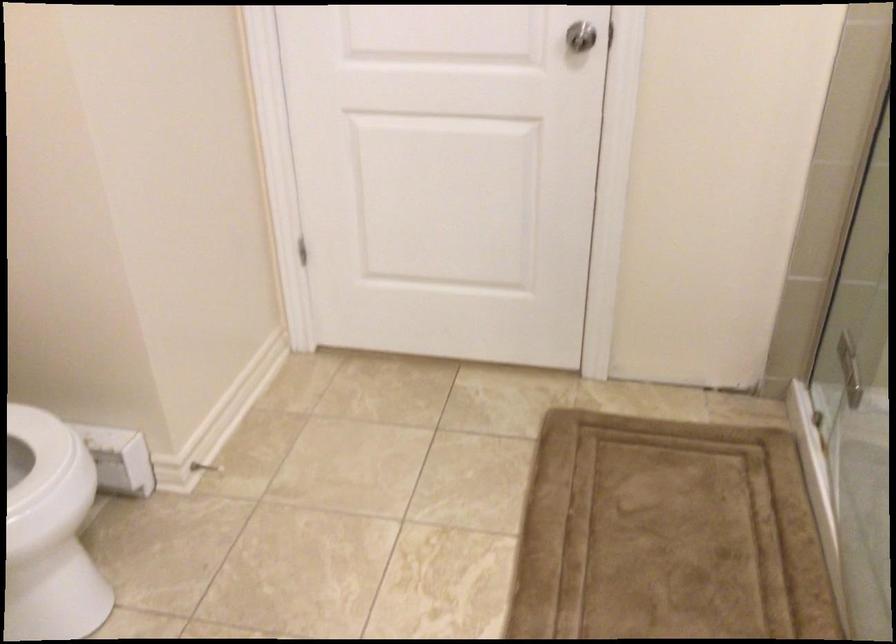
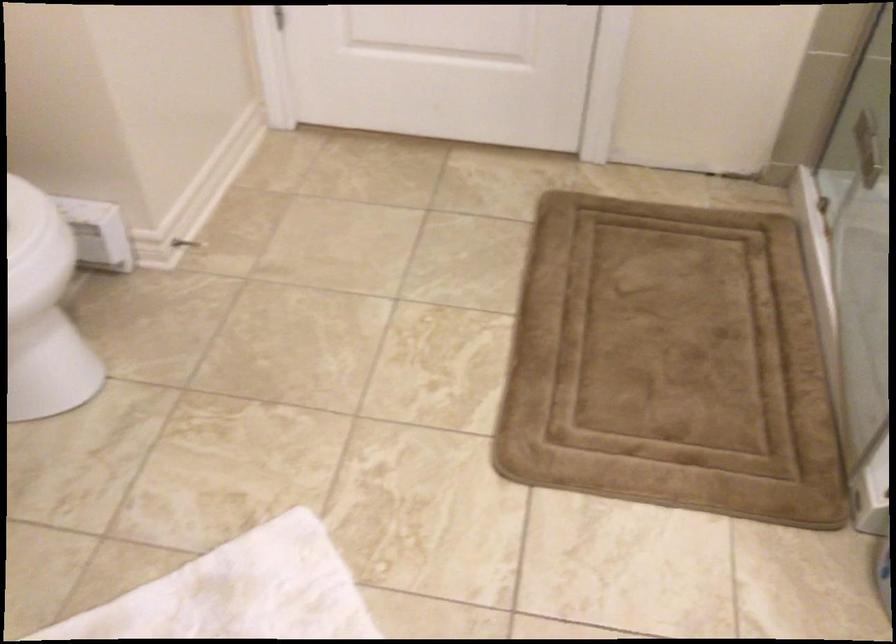
In the second image, find the point that corresponds to the point at 299,249 in the first image.

(274, 17)